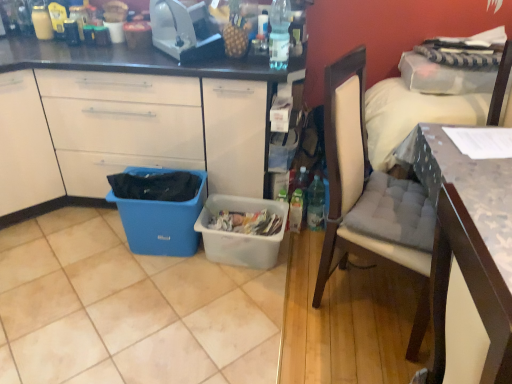
The image size is (512, 384). What are the coordinates of `vacant region under white plastic toaster at upper center (from a real-world perspective)` in the screenshot? It's located at (197, 58).